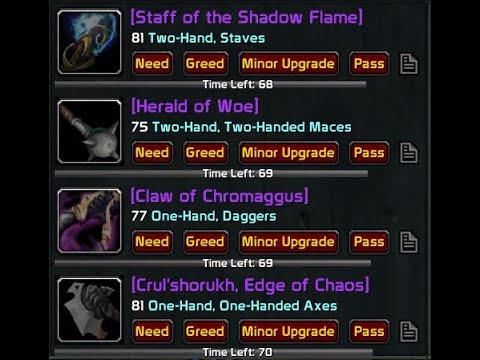
Image resolution: width=480 pixels, height=360 pixels. I want to click on counter, so click(231, 352).